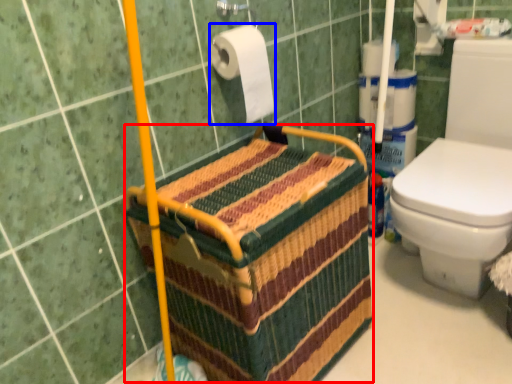
Question: Which point is closer to the camera, basket (highlighted by a red box) or toilet paper (highlighted by a blue box)?

Choices:
 (A) basket
 (B) toilet paper

Answer: (A)